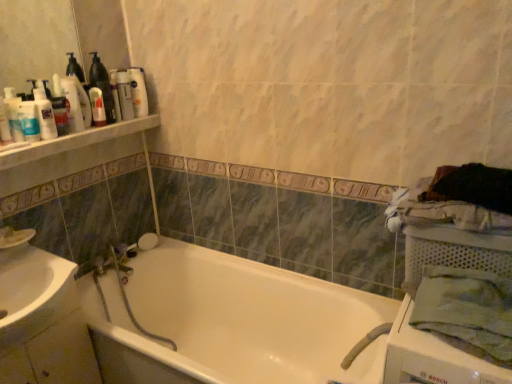
Find the location of a particular element. Image resolution: width=512 pixels, height=384 pixels. white mesh basket at right is located at coordinates [x=453, y=252].

Describe the element at coordinates (75, 141) in the screenshot. I see `white plastic shelf at upper left` at that location.

This screenshot has width=512, height=384. Find the location of `white glossy sink at lower left`. white glossy sink at lower left is located at coordinates (33, 292).

The width and height of the screenshot is (512, 384). Describe the element at coordinates (33, 292) in the screenshot. I see `white glossy sink at lower left` at that location.

What is the approximate width of white glossy lotion at upper left, the 5th toiletry in the back-to-front sequence?

The width of white glossy lotion at upper left, the 5th toiletry in the back-to-front sequence, is 1.61 inches.

Measure the distance between white glossy lotion at upper left, the 5th toiletry in the back-to-front sequence, and camera.

The distance of white glossy lotion at upper left, the 5th toiletry in the back-to-front sequence, from camera is 1.52 meters.

At what (x,y) coordinates should I click in order to perform the action: click on white mesh basket at right. Please return your answer as a coordinate pair (x, y). Image resolution: width=512 pixels, height=384 pixels. Looking at the image, I should click on (453, 252).

Do you think white glossy sink at lower left is within matte white lotion at upper left, the 1th toiletry from the back, or outside of it?

white glossy sink at lower left is not enclosed by matte white lotion at upper left, the 1th toiletry from the back.

From the image's perspective, which object appears higher, white glossy sink at lower left or matte white lotion at upper left, which is counted as the fifth toiletry, starting from the front?

matte white lotion at upper left, which is counted as the fifth toiletry, starting from the front, appears higher in the image.

From a real-world perspective, is white glossy sink at lower left located higher than matte white lotion at upper left, the 1th toiletry from the back?

No, from a real-world perspective, white glossy sink at lower left is not over matte white lotion at upper left, the 1th toiletry from the back

Is white glossy sink at lower left touching matte white lotion at upper left, the 1th toiletry from the back?

No.

Locate an element on the screen. The width and height of the screenshot is (512, 384). balustrade on the right of white glossy sink at lower left is located at coordinates (x=75, y=141).

Considering the sizes of objects white glossy sink at lower left and white plastic shelf at upper left in the image provided, who is wider, white glossy sink at lower left or white plastic shelf at upper left?

With larger width is white glossy sink at lower left.

Can you confirm if white glossy sink at lower left is positioned to the left of white plastic shelf at upper left?

Correct, you'll find white glossy sink at lower left to the left of white plastic shelf at upper left.

Is white glossy sink at lower left positioned in front of white plastic shelf at upper left?

Yes, the depth of white glossy sink at lower left is less than that of white plastic shelf at upper left.

Is translucent plastic bottle at upper left positioned with its back to white glossy bathtub at center?

No, translucent plastic bottle at upper left is not facing the opposite direction of white glossy bathtub at center.

Identify the location of bottle lying on the left of white glossy bathtub at center. (102, 86).

Locate an element on the screen. This screenshot has height=384, width=512. the 3rd toiletry in front of the translucent plastic bottle at upper left is located at coordinates (29, 121).

Is white glossy lotion at upper left, the 5th toiletry in the back-to-front sequence, turned away from translucent plastic bottle at upper left?

No, white glossy lotion at upper left, the 5th toiletry in the back-to-front sequence,'s orientation is not away from translucent plastic bottle at upper left.

Is white glossy lotion at upper left, the 5th toiletry in the back-to-front sequence, inside or outside of translucent plastic bottle at upper left?

white glossy lotion at upper left, the 5th toiletry in the back-to-front sequence, is spatially situated outside translucent plastic bottle at upper left.

How far apart are white glossy lotion at upper left, the first toiletry positioned from the front, and translucent plastic bottle at upper left?

white glossy lotion at upper left, the first toiletry positioned from the front, and translucent plastic bottle at upper left are 34.08 centimeters apart.

Considering the sizes of white plastic shelf at upper left and white glossy lotion at upper left, arranged as the fourth toiletry when viewed from the front, in the image, is white plastic shelf at upper left bigger or smaller than white glossy lotion at upper left, arranged as the fourth toiletry when viewed from the front,?

Considering their sizes, white plastic shelf at upper left takes up more space than white glossy lotion at upper left, arranged as the fourth toiletry when viewed from the front.

Is white plastic shelf at upper left inside or outside of white glossy lotion at upper left, arranged as the fourth toiletry when viewed from the front?

white plastic shelf at upper left is located beyond the bounds of white glossy lotion at upper left, arranged as the fourth toiletry when viewed from the front.

From a real-world perspective, which is physically above, white plastic shelf at upper left or white glossy lotion at upper left, arranged as the fourth toiletry when viewed from the front?

In real-world perspective, white glossy lotion at upper left, arranged as the fourth toiletry when viewed from the front, is above.

Considering the relative sizes of white plastic shelf at upper left and white glossy lotion at upper left, arranged as the fourth toiletry when viewed from the front, in the image provided, is white plastic shelf at upper left thinner than white glossy lotion at upper left, arranged as the fourth toiletry when viewed from the front,?

No.

Considering the relative sizes of white glossy bottles at upper left and white glossy bathtub at center in the image provided, is white glossy bottles at upper left smaller than white glossy bathtub at center?

Yes, white glossy bottles at upper left is smaller than white glossy bathtub at center.

The width and height of the screenshot is (512, 384). What are the coordinates of `bathtub on the right of white glossy bottles at upper left` in the screenshot? It's located at (238, 318).

From the image's perspective, which one is positioned higher, white glossy bottles at upper left or white glossy bathtub at center?

white glossy bottles at upper left appears higher in the image.

Which object is positioned more to the left, white glossy bottles at upper left or white glossy bathtub at center?

white glossy bottles at upper left.

Can you confirm if green cotton bath towel at right is smaller than matte white lotion at upper left, which is the second toiletry in front-to-back order?

Actually, green cotton bath towel at right might be larger than matte white lotion at upper left, which is the second toiletry in front-to-back order.

Can you see green cotton bath towel at right touching matte white lotion at upper left, arranged as the fourth toiletry when viewed from the back?

There is a gap between green cotton bath towel at right and matte white lotion at upper left, arranged as the fourth toiletry when viewed from the back.

Is green cotton bath towel at right turned away from matte white lotion at upper left, which is the second toiletry in front-to-back order?

No, green cotton bath towel at right is not facing away from matte white lotion at upper left, which is the second toiletry in front-to-back order.

Identify the location of sink below the matte white lotion at upper left, which is counted as the fifth toiletry, starting from the front (from a real-world perspective). The image size is (512, 384). (33, 292).

In order to click on sink that is below the white plastic shelf at upper left (from the image's perspective) in this screenshot , I will do `click(33, 292)`.

Which object lies further to the anchor point matte plastic bottle at upper left, which is the 3th toiletry from back to front, matte white lotion at upper left, the 1th toiletry from the back, or translucent plastic bottle at upper left?

matte white lotion at upper left, the 1th toiletry from the back, lies further to matte plastic bottle at upper left, which is the 3th toiletry from back to front, than the other object.

Considering their positions, is matte white lotion at upper left, the 1th toiletry from the back, positioned further to white glossy lotion at upper left, the 5th toiletry in the back-to-front sequence, than white mesh basket at right?

white mesh basket at right lies further to white glossy lotion at upper left, the 5th toiletry in the back-to-front sequence, than the other object.

Estimate the real-world distances between objects in this image. Which object is further from white glossy bottles at upper left, matte white lotion at upper left, the 1th toiletry from the back, or matte white lotion at upper left, arranged as the fourth toiletry when viewed from the back?

matte white lotion at upper left, arranged as the fourth toiletry when viewed from the back.

Looking at the image, which one is located closer to translucent plastic bottle at upper left, white glossy bathtub at center or matte plastic bottle at upper left, positioned as the 3th toiletry in front-to-back order?

matte plastic bottle at upper left, positioned as the 3th toiletry in front-to-back order, lies closer to translucent plastic bottle at upper left than the other object.

When comparing their distances from white glossy sink at lower left, does translucent plastic bottle at upper left or white mesh basket at right seem further?

The object further to white glossy sink at lower left is white mesh basket at right.

Looking at the image, which one is located closer to matte white lotion at upper left, which is counted as the fifth toiletry, starting from the front, green cotton bath towel at right or white glossy bathtub at center?

white glossy bathtub at center is closer to matte white lotion at upper left, which is counted as the fifth toiletry, starting from the front.

Based on their spatial positions, is matte white lotion at upper left, the 1th toiletry from the back, or white plastic shelf at upper left further from white glossy lotion at upper left, the first toiletry positioned from the front?

The object further to white glossy lotion at upper left, the first toiletry positioned from the front, is matte white lotion at upper left, the 1th toiletry from the back.

Looking at this image, which object lies further to the anchor point white glossy bottles at upper left, white mesh basket at right or white glossy sink at lower left?

white mesh basket at right.

Identify the location of bottle between matte white lotion at upper left, which is the second toiletry in front-to-back order, and white glossy lotion at upper left, arranged as the fourth toiletry when viewed from the front, in the front-back direction. (102, 86).

Find the location of a particular element. Image resolution: width=512 pixels, height=384 pixels. bottle between white glossy bottles at upper left and white mesh basket at right in the horizontal direction is located at coordinates (102, 86).

Locate an element on the screen. The height and width of the screenshot is (384, 512). balustrade between white glossy lotion at upper left, arranged as the fourth toiletry when viewed from the front, and white glossy bathtub at center, in the vertical direction is located at coordinates (75, 141).

Locate an element on the screen. This screenshot has width=512, height=384. bath towel between white glossy lotion at upper left, arranged as the fourth toiletry when viewed from the front, and white mesh basket at right is located at coordinates (467, 309).